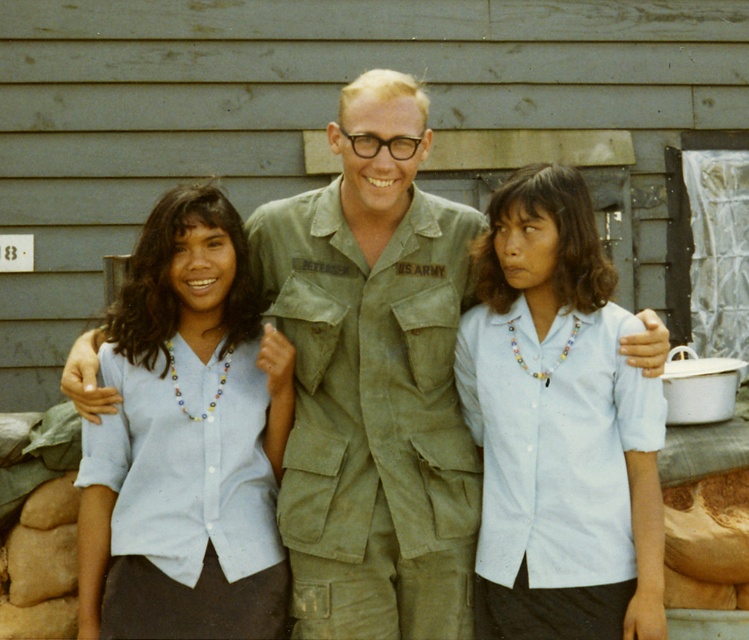
Which is below, green matte uniform at center or light blue cotton shirt at left?

light blue cotton shirt at left is below.

Which is in front, point (366, 502) or point (216, 365)?

Point (366, 502) is more forward.

Find the location of a particular element. The height and width of the screenshot is (640, 749). green matte uniform at center is located at coordinates (374, 381).

Identify the location of green matte uniform at center. (374, 381).

Measure the distance between point (565, 273) and camera.

Point (565, 273) and camera are 3.73 meters apart.

Identify the location of white matte shirt at center. (557, 426).

Can you confirm if green matte uniform at center is wider than white matte shirt at center?

Correct, the width of green matte uniform at center exceeds that of white matte shirt at center.

Can you confirm if green matte uniform at center is positioned below white matte shirt at center?

No.

Locate an element on the screen. This screenshot has height=640, width=749. green matte uniform at center is located at coordinates (374, 381).

Locate an element on the screen. green matte uniform at center is located at coordinates (374, 381).